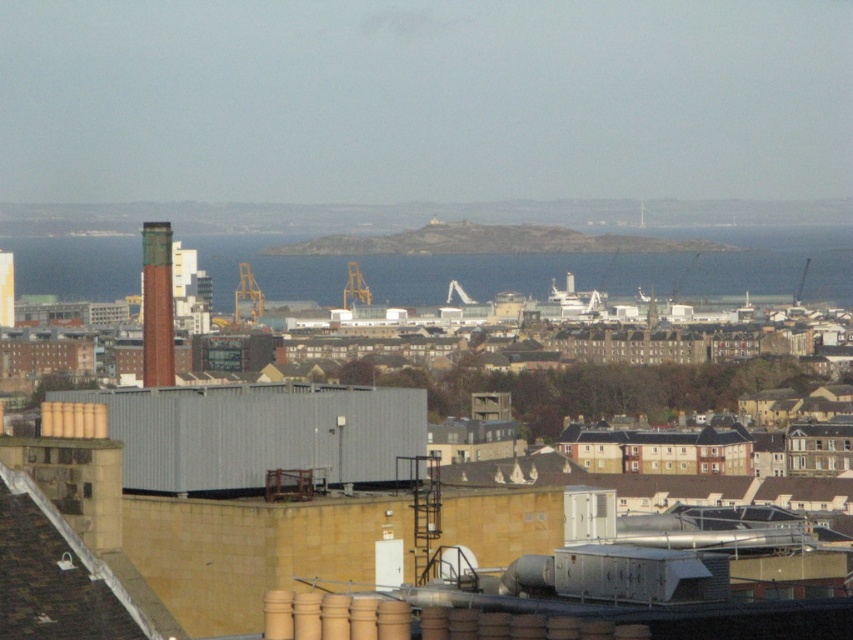
Is metallic gray factory at center below metallic yellow crane at center?

Indeed, metallic gray factory at center is positioned under metallic yellow crane at center.

Locate an element on the screen. metallic gray factory at center is located at coordinates (209, 529).

Which is above, metallic gray factory at center or blue water at center?

blue water at center

Who is more distant from viewer, (155,579) or (264,288)?

The point (264,288) is behind.

Where is `metallic gray factory at center`? metallic gray factory at center is located at coordinates (209, 529).

Can you confirm if yellow metallic crane at center is shorter than metallic yellow crane at center?

No, yellow metallic crane at center is not shorter than metallic yellow crane at center.

From the picture: Between yellow metallic crane at center and metallic yellow crane at center, which one is positioned higher?

metallic yellow crane at center is above.

The width and height of the screenshot is (853, 640). Identify the location of yellow metallic crane at center. (247, 296).